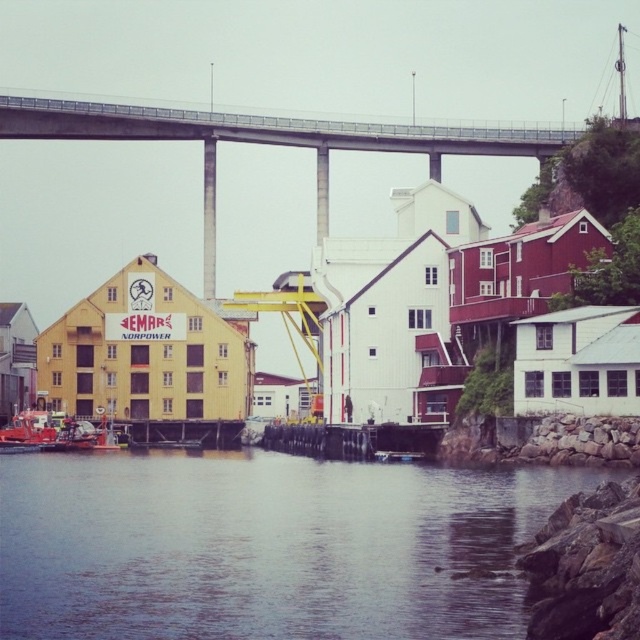
You are a boat captain planning to navigate under the concrete bridge at upper center. From your vantage point on the smooth water at lower center, will you have enough clearance to pass underneath without hitting the bridge?

The smooth water at lower center is below the concrete bridge at upper center, which means there is sufficient vertical clearance for the boat to pass underneath safely.

You are a boat operator planning to navigate through the scene. The boat requires a water passage that is at least as wide as the concrete bridge at upper center. Can the smooth water at lower center accommodate your boat?

The smooth water at lower center has a width less than the concrete bridge at upper center, so it cannot accommodate the boat requiring a passage as wide as the bridge.

Looking at this image, you are a boat captain planning to navigate your vessel under the concrete bridge at upper center. The height of your boat matches the height of the smooth water at lower center. Will your boat be able to pass under the bridge without hitting it?

The smooth water at lower center is not as tall as the concrete bridge at upper center. Since the boat has the same height as the water, it should safely pass under the bridge without any issues.